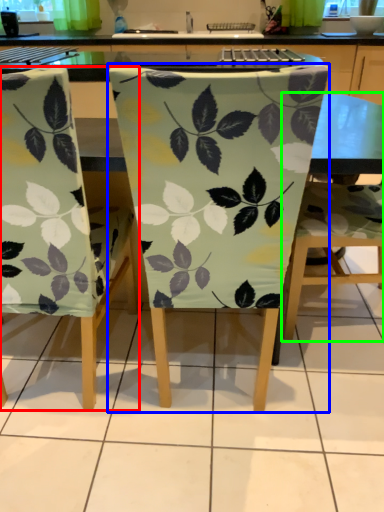
Question: Estimate the real-world distances between objects in this image. Which object is farther from chair (highlighted by a red box), chair (highlighted by a blue box) or chair (highlighted by a green box)?

Choices:
 (A) chair
 (B) chair

Answer: (B)